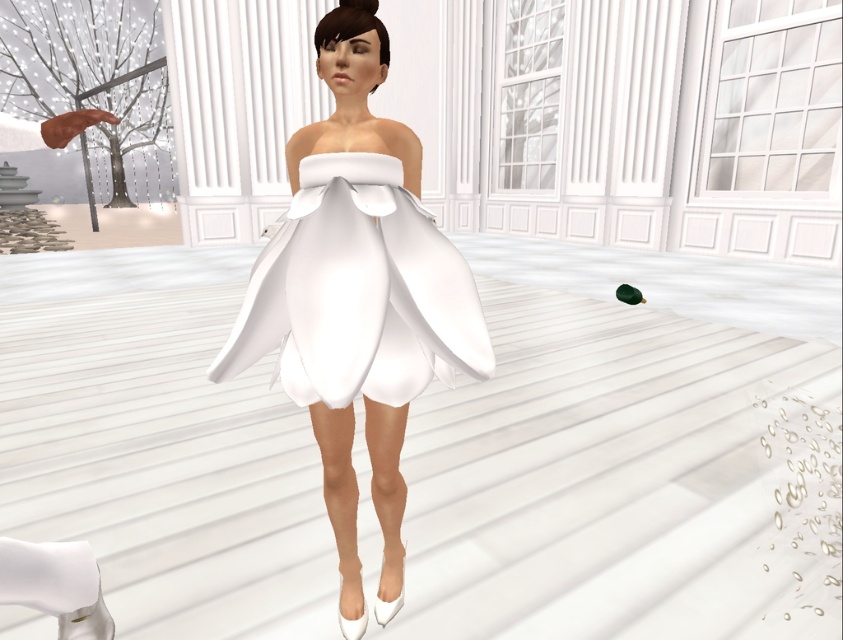
Question: Which point is farther to the camera?

Choices:
 (A) (416, 291)
 (B) (310, 356)

Answer: (A)

Question: Considering the relative positions of white satin dress at center and satin white dress at center in the image provided, where is white satin dress at center located with respect to satin white dress at center?

Choices:
 (A) above
 (B) below

Answer: (B)

Question: Is white satin dress at center to the left of satin white dress at center from the viewer's perspective?

Choices:
 (A) no
 (B) yes

Answer: (A)

Question: Among these points, which one is nearest to the camera?

Choices:
 (A) (326, 397)
 (B) (267, 300)

Answer: (A)

Question: Which point is closer to the camera taking this photo?

Choices:
 (A) (334, 392)
 (B) (264, 282)

Answer: (A)

Question: Observing the image, what is the correct spatial positioning of white satin dress at center in reference to satin white dress at center?

Choices:
 (A) below
 (B) above

Answer: (A)